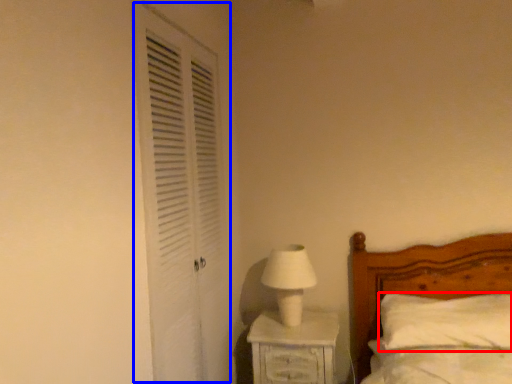
Question: Which of the following is the closest to the observer, pillow (highlighted by a red box) or screen door (highlighted by a blue box)?

Choices:
 (A) pillow
 (B) screen door

Answer: (B)